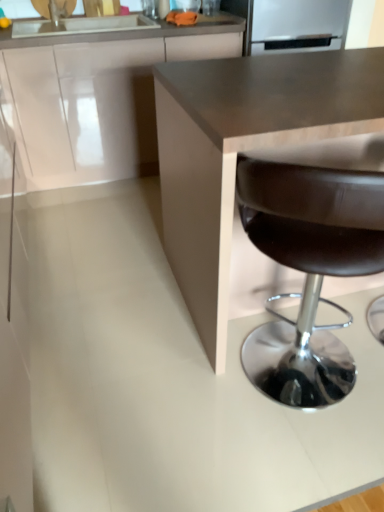
What are the coordinates of `vacant area that is in front of brown leather stool at lower right` in the screenshot? It's located at (297, 464).